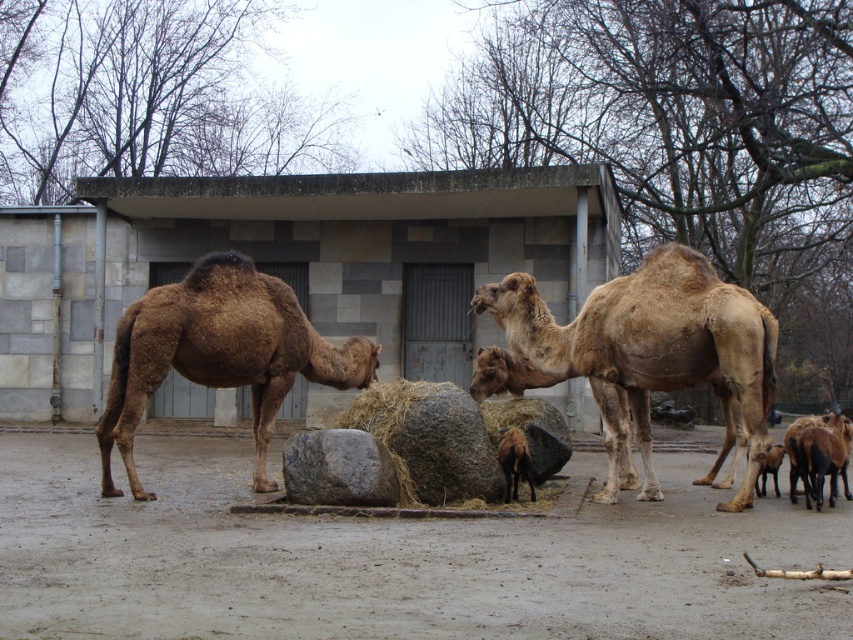
You are a zookeeper standing at the origin point of the enclosure. You need to locate the brown matte camel at center. Which direction should you move to reach it?

The brown matte camel at center is located at coordinate point 0.694 on the x axis and 0.748 on the y axis. Since you are at the origin point, you should move towards the positive x and positive y direction to reach it.